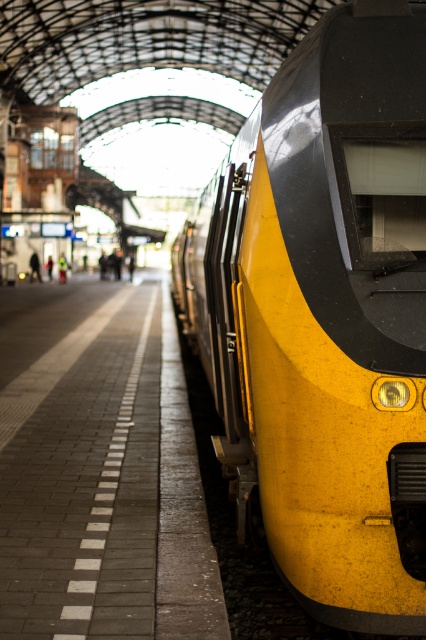
This screenshot has height=640, width=426. What do you see at coordinates (325, 314) in the screenshot?
I see `yellow matte train at right` at bounding box center [325, 314].

Between point (296, 81) and point (69, 342), which one is positioned in front?

Point (296, 81)

At what (x,y) coordinates should I click in order to perform the action: click on yellow matte train at right. Please return your answer as a coordinate pair (x, y). This screenshot has width=426, height=640. Looking at the image, I should click on (325, 314).

The height and width of the screenshot is (640, 426). Find the location of `yellow matte train at right`. yellow matte train at right is located at coordinates (325, 314).